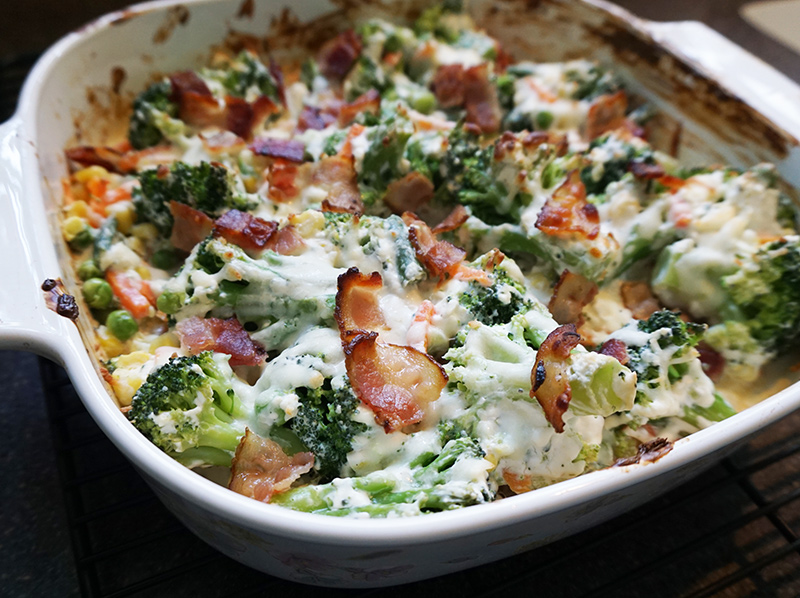
You are a GUI agent. You are given a task and a screenshot of the screen. Output one action in this format:
    pyautogui.click(x=<x>, y=<y>)
    Task: Click on the casserole dish
    Image resolution: width=800 pixels, height=598 pixels.
    Given the screenshot: What is the action you would take?
    pyautogui.click(x=570, y=521)